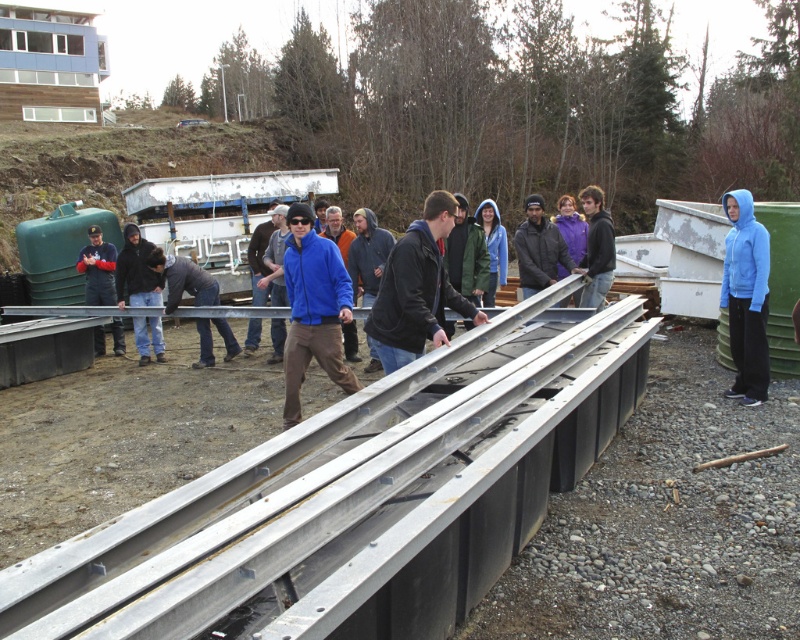
Question: Is silver metallic rail at center smaller than blue fleece jacket at right?

Choices:
 (A) yes
 (B) no

Answer: (B)

Question: Which is farther from the blue fleece jacket at right?

Choices:
 (A) blue fleece jacket at center
 (B) silver metallic rail at center

Answer: (A)

Question: Considering the real-world distances, which object is farthest from the blue fleece jacket at center?

Choices:
 (A) silver metallic rail at center
 (B) blue fleece jacket at right

Answer: (B)

Question: From the image, what is the correct spatial relationship of silver metallic rail at center in relation to blue fleece jacket at right?

Choices:
 (A) below
 (B) above

Answer: (A)

Question: Does silver metallic rail at center appear on the right side of blue fleece jacket at right?

Choices:
 (A) yes
 (B) no

Answer: (B)

Question: Which object is the closest to the blue fleece jacket at center?

Choices:
 (A) blue fleece jacket at right
 (B) silver metallic rail at center

Answer: (B)